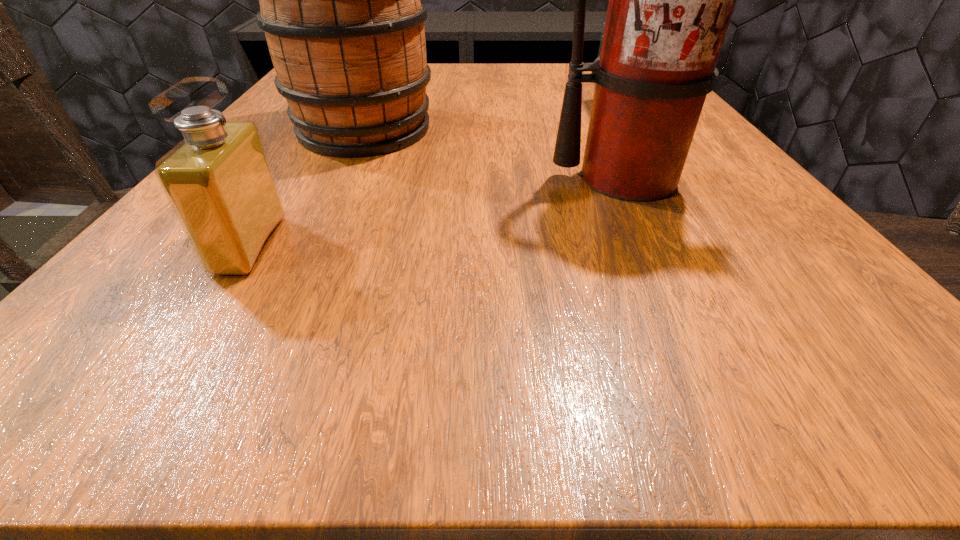
Where is `the tallest object`? the tallest object is located at coordinates (671, 0).

Identify the location of the third shortest object. The image size is (960, 540). (340, 5).

Find the location of a particular element. The height and width of the screenshot is (540, 960). the farther perfume is located at coordinates (602, 32).

At what (x,y) coordinates should I click in order to perform the action: click on the nearer perfume. Please return your answer as a coordinate pair (x, y). Looking at the image, I should click on (218, 180).

In order to click on the nearest object in this screenshot , I will do `click(218, 180)`.

The width and height of the screenshot is (960, 540). In order to click on vacant region located toward the nozzle of the tallest object in this screenshot , I will do `click(675, 278)`.

You are a GUI agent. You are given a task and a screenshot of the screen. Output one action in this format:
    pyautogui.click(x=<x>, y=<y>)
    Task: Click on the vacant space located on the right of the cider
    
    Given the screenshot: What is the action you would take?
    pyautogui.click(x=529, y=130)

What are the coordinates of `free region located on the front label of the farther perfume` in the screenshot? It's located at (401, 109).

At what (x,y) coordinates should I click in order to perform the action: click on vacant position located 0.400m on the front label of the farther perfume. Please return your answer as a coordinate pair (x, y). Looking at the image, I should click on (401, 109).

Find the location of a particular element. This screenshot has width=960, height=540. vacant space located on the front label of the farther perfume is located at coordinates (522, 109).